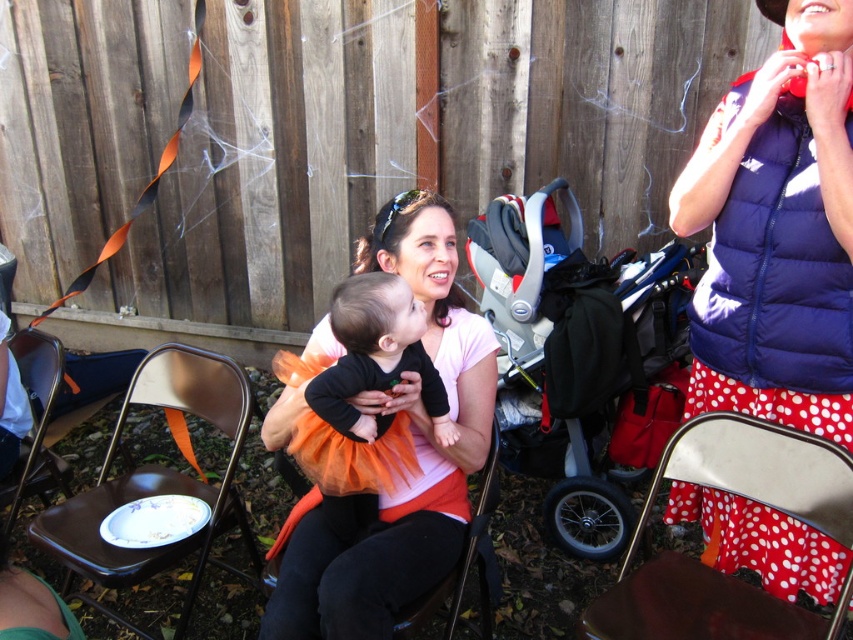
Consider the image. Is blue puffy vest at upper right wider than metallic silver chair at center?

Yes, blue puffy vest at upper right is wider than metallic silver chair at center.

Does point (770, 400) lie in front of point (422, 611)?

No.

This screenshot has width=853, height=640. Identify the location of blue puffy vest at upper right. (776, 230).

Is blue puffy vest at upper right wider than brown leather chair at lower left?

Correct, the width of blue puffy vest at upper right exceeds that of brown leather chair at lower left.

Is the position of blue puffy vest at upper right less distant than that of brown leather chair at lower left?

Yes, it is in front of brown leather chair at lower left.

Image resolution: width=853 pixels, height=640 pixels. What are the coordinates of `blue puffy vest at upper right` in the screenshot? It's located at point(776,230).

The width and height of the screenshot is (853, 640). Identify the location of blue puffy vest at upper right. (776, 230).

The height and width of the screenshot is (640, 853). What do you see at coordinates (160, 477) in the screenshot? I see `brown wood chair at lower left` at bounding box center [160, 477].

Looking at this image, does brown wood chair at lower left have a smaller size compared to orange tulle skirt at center?

No.

Image resolution: width=853 pixels, height=640 pixels. What are the coordinates of `brown wood chair at lower left` in the screenshot? It's located at (160, 477).